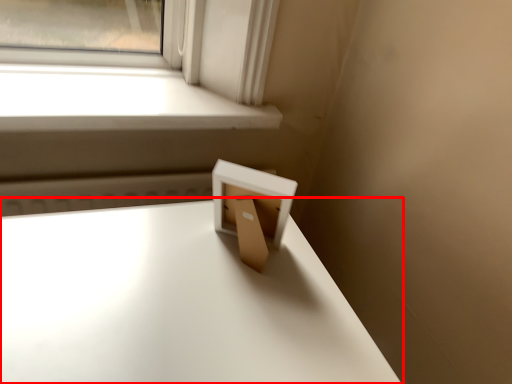
Question: In this image, where is table (annotated by the red box) located relative to window?

Choices:
 (A) left
 (B) right

Answer: (B)